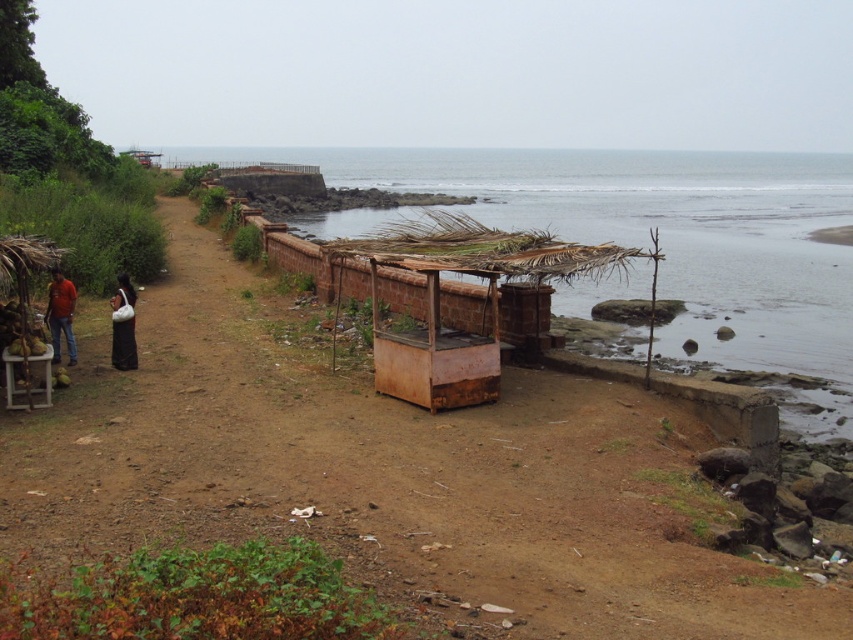
Between clear water at center and rusty wood shack at center, which one has more height?

clear water at center

What are the coordinates of `clear water at center` in the screenshot? It's located at (663, 237).

Is rusty wood shack at center above dark brown fabric dress at left?

Yes.

Does rusty wood shack at center come behind dark brown fabric dress at left?

No, it is not.

The height and width of the screenshot is (640, 853). What do you see at coordinates (438, 300) in the screenshot?
I see `rusty wood shack at center` at bounding box center [438, 300].

Identify the location of rusty wood shack at center. The height and width of the screenshot is (640, 853). (438, 300).

Can you confirm if clear water at center is positioned below matte red shirt at left?

No.

Can you confirm if clear water at center is bigger than matte red shirt at left?

Correct, clear water at center is larger in size than matte red shirt at left.

In the scene shown: Measure the distance between clear water at center and camera.

The distance of clear water at center from camera is 9.75 meters.

You are a GUI agent. You are given a task and a screenshot of the screen. Output one action in this format:
    pyautogui.click(x=<x>, y=<y>)
    Task: Click on the clear water at center
    The width and height of the screenshot is (853, 640).
    Given the screenshot: What is the action you would take?
    pyautogui.click(x=663, y=237)